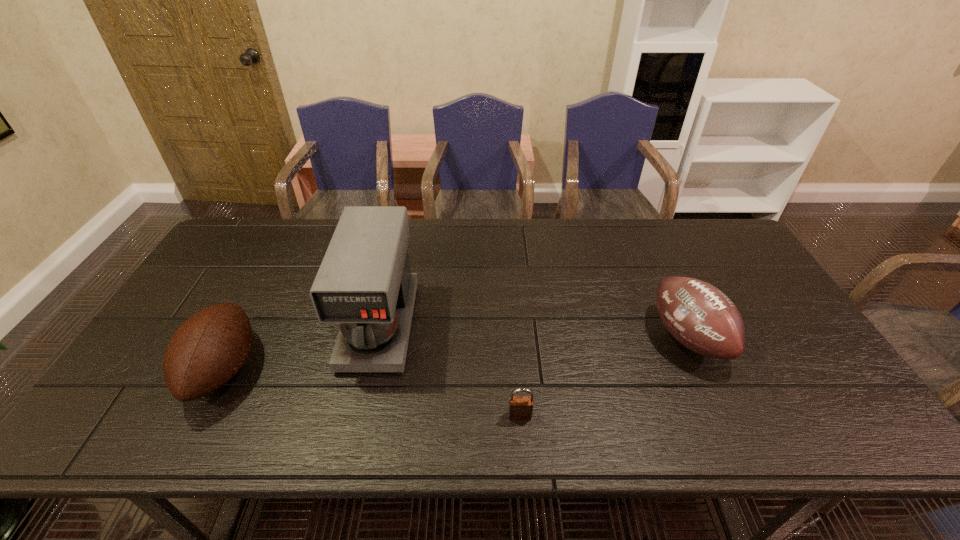
You are a GUI agent. You are given a task and a screenshot of the screen. Output one action in this format:
    pyautogui.click(x=<x>, y=<y>)
    Task: Click on the padlock at the near edge
    This screenshot has width=960, height=540.
    Given the screenshot: What is the action you would take?
    pyautogui.click(x=520, y=407)

Where is `object that is at the left edge`? Image resolution: width=960 pixels, height=540 pixels. object that is at the left edge is located at coordinates (210, 347).

I want to click on object that is at the near left corner, so click(x=210, y=347).

This screenshot has height=540, width=960. In order to click on blank space at the far edge of the desktop in this screenshot , I will do `click(656, 233)`.

This screenshot has height=540, width=960. In the image, there is a desktop. What are the coordinates of `free space at the left edge` in the screenshot? It's located at (248, 281).

You are a GUI agent. You are given a task and a screenshot of the screen. Output one action in this format:
    pyautogui.click(x=<x>, y=<y>)
    Task: Click on the vacant space at the right edge of the desktop
    The height and width of the screenshot is (540, 960).
    Given the screenshot: What is the action you would take?
    pyautogui.click(x=740, y=299)

This screenshot has height=540, width=960. What are the coordinates of `blank space at the far left corner` in the screenshot? It's located at (238, 257).

I want to click on free space at the near left corner of the desktop, so click(x=166, y=423).

In order to click on free area in between the left football and the padlock in this screenshot , I will do `click(372, 393)`.

Image resolution: width=960 pixels, height=540 pixels. I want to click on free space between the second object from right to left and the tallest object, so click(x=450, y=370).